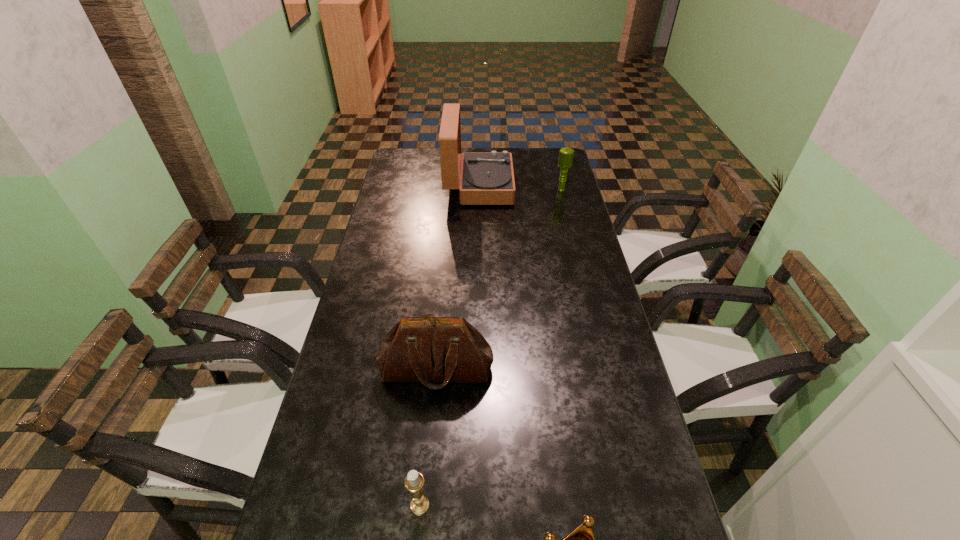
Locate an element on the screen. The image size is (960, 540). the tallest object is located at coordinates (487, 178).

The width and height of the screenshot is (960, 540). Find the location of `the fourth shortest object`. the fourth shortest object is located at coordinates (444, 350).

Find the location of `the third nearest object`. the third nearest object is located at coordinates (444, 350).

At what (x,y) coordinates should I click in order to perform the action: click on microphone. Please return your answer as a coordinate pair (x, y). This screenshot has width=960, height=540. Looking at the image, I should click on (565, 160).

Image resolution: width=960 pixels, height=540 pixels. I want to click on the fourth farthest object, so click(414, 482).

The image size is (960, 540). What are the coordinates of `candle holder` in the screenshot? It's located at (414, 482).

This screenshot has width=960, height=540. In order to click on vacant space located on the face of the tallest object in this screenshot , I will do `click(575, 186)`.

Where is `vacant space located on the back of the third nearest object`? vacant space located on the back of the third nearest object is located at coordinates (445, 268).

Locate an element on the screen. The image size is (960, 540). vacant space situated on the left of the rightmost object is located at coordinates (460, 190).

The width and height of the screenshot is (960, 540). I want to click on blank space located 0.140m on the right of the second nearest object, so click(496, 505).